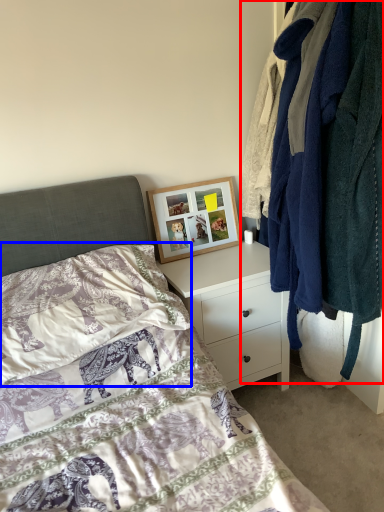
Question: Which of the following is the closest to the observer, closet (highlighted by a red box) or pillow (highlighted by a blue box)?

Choices:
 (A) closet
 (B) pillow

Answer: (A)